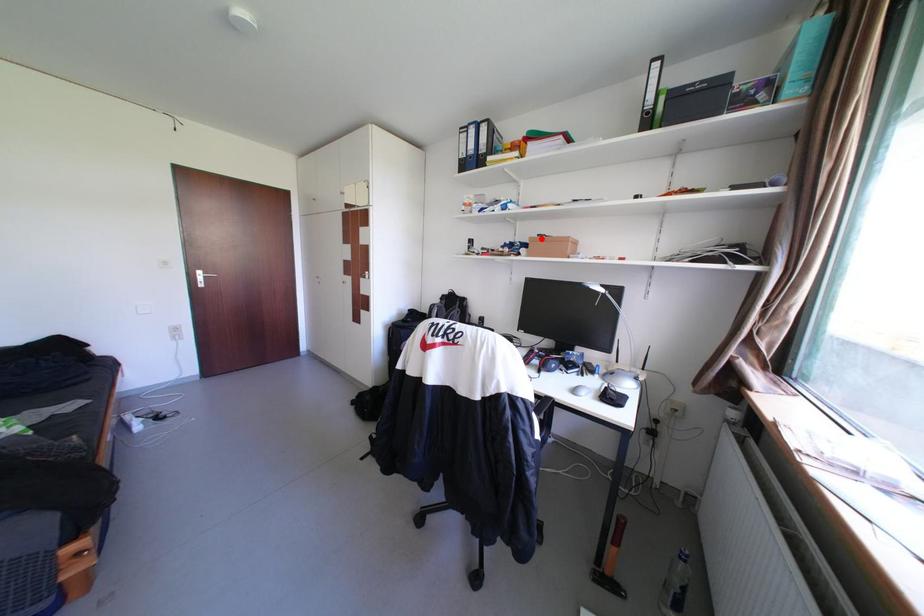
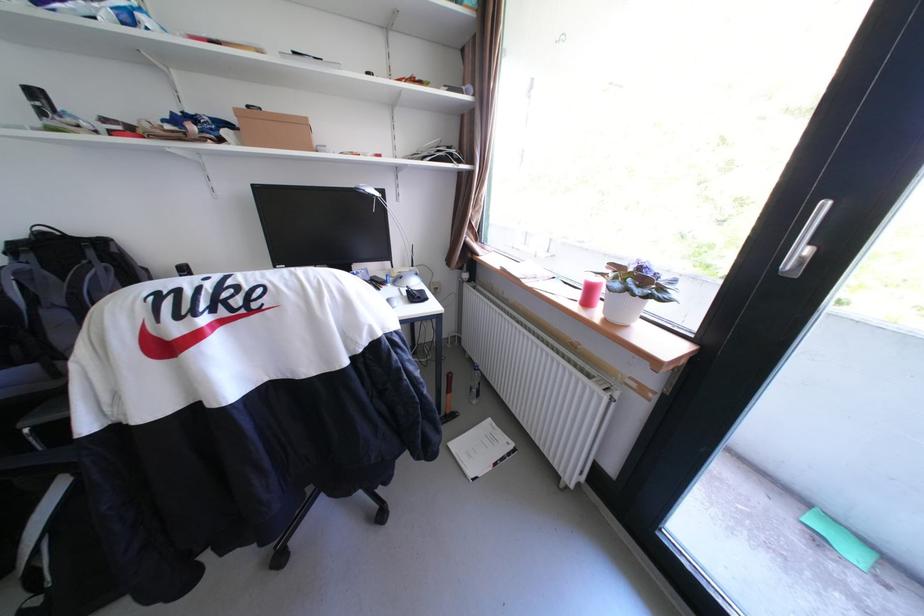
Where in the second image is the point corresponding to the highlighted location from the first image?

(247, 111)